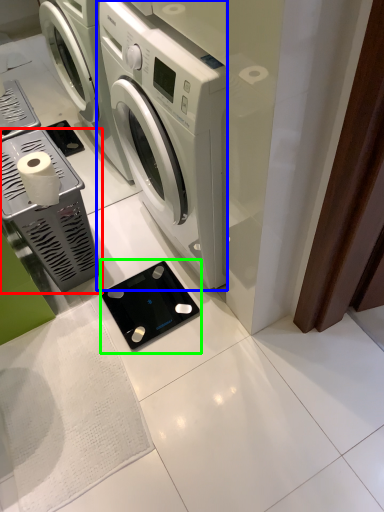
Question: Which object is positioned closest to appliance (highlighted by a red box)? Select from washing machine (highlighted by a blue box) and appliance (highlighted by a green box).

Choices:
 (A) washing machine
 (B) appliance

Answer: (B)